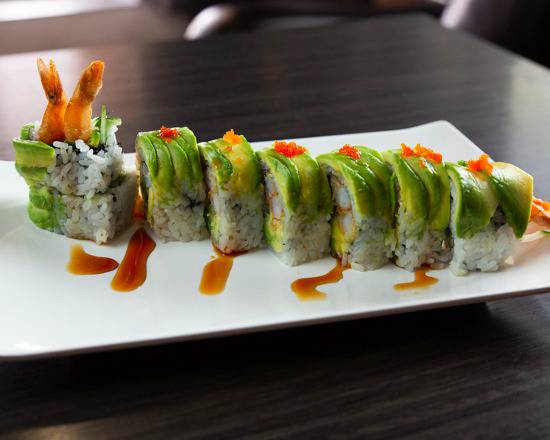
Identify the location of ceramic plate. This screenshot has width=550, height=440. (4, 283).